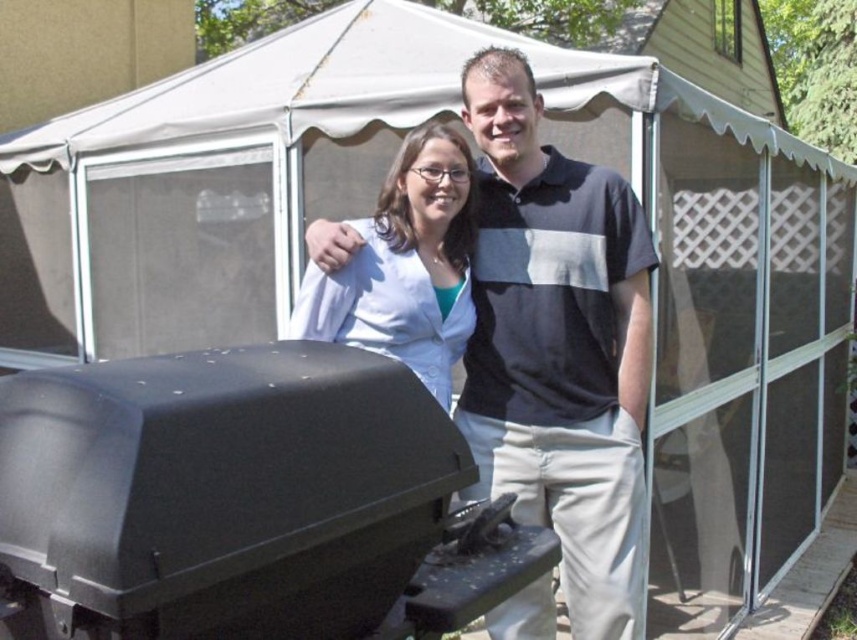
Question: Which point appears farthest from the camera in this image?

Choices:
 (A) (424, 230)
 (B) (330, 109)

Answer: (B)

Question: Among these points, which one is nearest to the camera?

Choices:
 (A) (75, 380)
 (B) (646, 404)
 (C) (142, 116)
 (D) (445, 131)

Answer: (A)

Question: Is dark gray polo shirt at center to the right of white fabric canopy at upper center from the viewer's perspective?

Choices:
 (A) no
 (B) yes

Answer: (B)

Question: Does dark gray polo shirt at center appear on the right side of white matte shirt at center?

Choices:
 (A) no
 (B) yes

Answer: (B)

Question: Considering the relative positions of black matte barbecue grill at lower left and white fabric canopy at upper center in the image provided, where is black matte barbecue grill at lower left located with respect to white fabric canopy at upper center?

Choices:
 (A) left
 (B) right

Answer: (B)

Question: Which object is positioned farthest from the white fabric canopy at upper center?

Choices:
 (A) white matte shirt at center
 (B) dark gray polo shirt at center

Answer: (B)